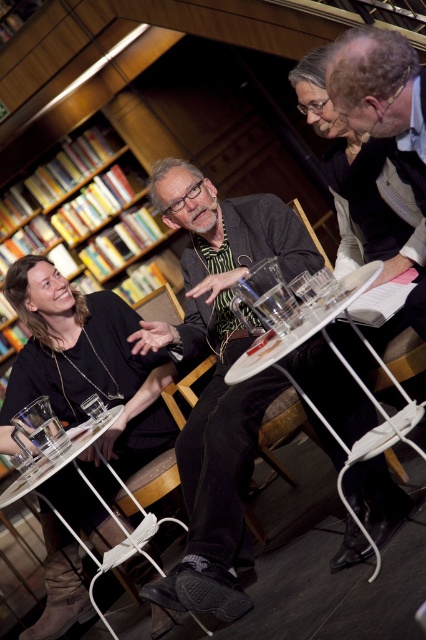
Is matte black sweater at center thinner than clear glass table at lower left?

No, matte black sweater at center is not thinner than clear glass table at lower left.

Is matte black sweater at center further to the viewer compared to clear glass table at lower left?

No, matte black sweater at center is in front of clear glass table at lower left.

Is point (249, 458) in front of point (26, 492)?

No, (249, 458) is further to viewer.

This screenshot has height=640, width=426. Identify the location of matte black sweater at center. (218, 376).

At what (x,y) coordinates should I click in order to perform the action: click on wooden bookcase at upper left. Please return your answer as a coordinate pair (x, y). This screenshot has width=426, height=640. Looking at the image, I should click on (86, 362).

Between point (81, 394) and point (54, 472), which one is positioned behind?

Positioned behind is point (81, 394).

Where is `wooden bookcase at upper left`? Image resolution: width=426 pixels, height=640 pixels. wooden bookcase at upper left is located at coordinates (86, 362).

Is matte black sweater at center positioned behind white plastic table at center?

Yes, it is.

Who is more distant from viewer, (198, 342) or (363, 340)?

Positioned behind is point (198, 342).

Identify the location of matte black sweater at center. This screenshot has width=426, height=640. (218, 376).